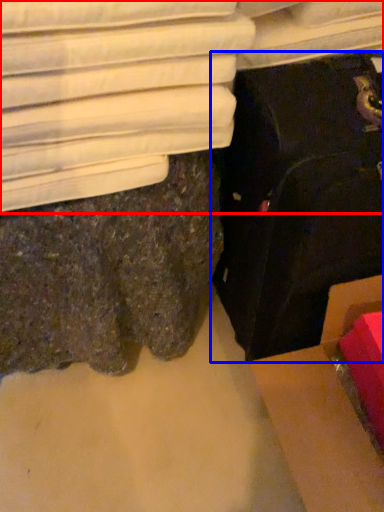
Question: Among these objects, which one is farthest to the camera, furniture (highlighted by a red box) or suitcase (highlighted by a blue box)?

Choices:
 (A) furniture
 (B) suitcase

Answer: (A)